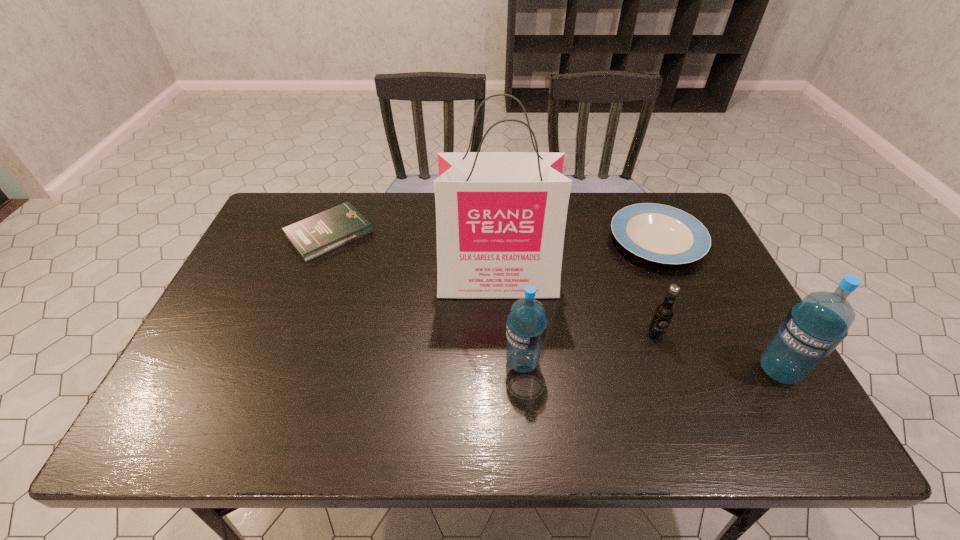
Please point a vacant point for placing a water bottle on the left. Please provide its 2D coordinates. Your answer should be formatted as a tuple, i.e. [(x, y)], where the tuple contains the x and y coordinates of a point satisfying the conditions above.

[(275, 354)]